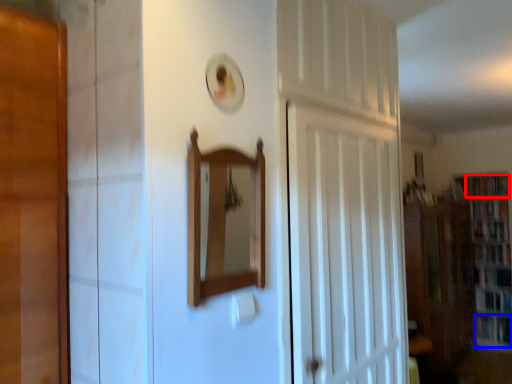
Question: Which object appears closest to the camera in this image, book (highlighted by a red box) or book (highlighted by a blue box)?

Choices:
 (A) book
 (B) book

Answer: (B)